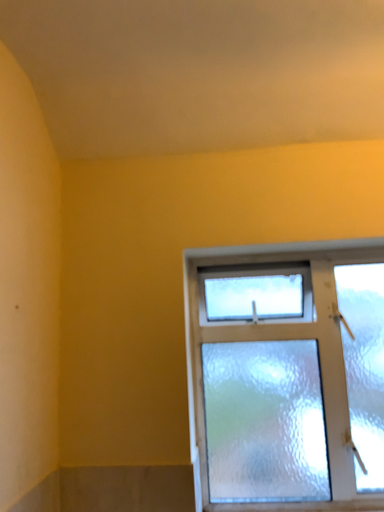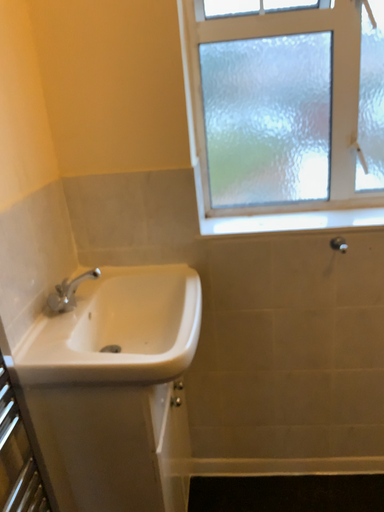
Question: How did the camera likely rotate when shooting the video?

Choices:
 (A) rotated upward
 (B) rotated downward

Answer: (B)